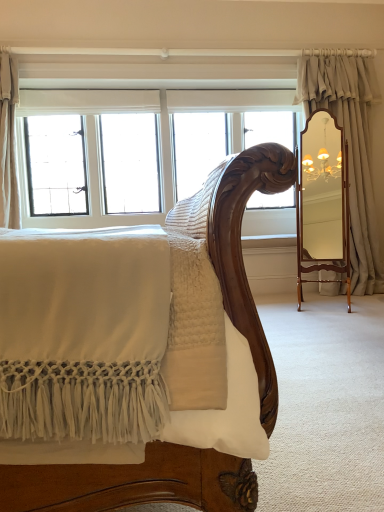
Question: In terms of size, does beige linen curtain at upper left, which is counted as the 2th curtain, starting from the right, appear bigger or smaller than white glass window at upper left?

Choices:
 (A) big
 (B) small

Answer: (B)

Question: Relative to white glass window at upper left, is beige linen curtain at upper left, which is counted as the 2th curtain, starting from the right, in front or behind?

Choices:
 (A) behind
 (B) front

Answer: (B)

Question: Based on their relative distances, which object is nearer to the white glass window at upper left?

Choices:
 (A) satin beige curtain at right, placed as the second curtain when sorted from left to right
 (B) beige linen curtain at upper left, which is counted as the 2th curtain, starting from the right

Answer: (B)

Question: Considering the real-world distances, which object is closest to the beige linen curtain at upper left, which is the 1th curtain in left-to-right order?

Choices:
 (A) white glass window at upper left
 (B) satin beige curtain at right, marked as the first curtain in a right-to-left arrangement

Answer: (A)